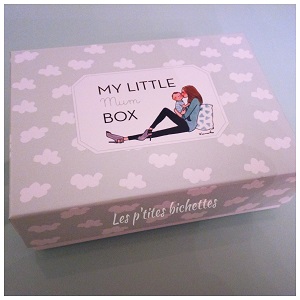
You are a GUI agent. You are given a task and a screenshot of the screen. Output one action in this format:
    pyautogui.click(x=<x>, y=<y>)
    Task: Click on the gray table
    The width and height of the screenshot is (300, 300).
    Given the screenshot: What is the action you would take?
    pyautogui.click(x=218, y=256)